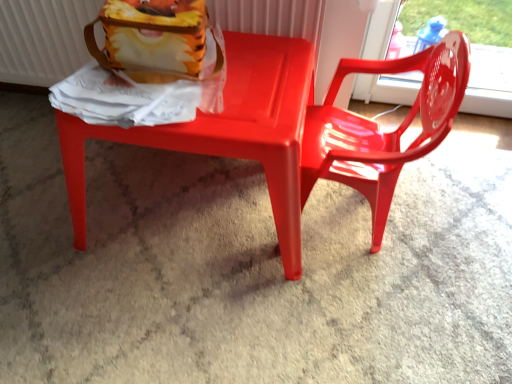
Question: Can you confirm if glossy plastic chair at center, which is the second chair in left-to-right order, is positioned to the left of matte white radiator at upper left?

Choices:
 (A) no
 (B) yes

Answer: (A)

Question: Considering the relative positions of glossy plastic chair at center, the first chair positioned from the right, and matte white radiator at upper left in the image provided, is glossy plastic chair at center, the first chair positioned from the right, behind matte white radiator at upper left?

Choices:
 (A) yes
 (B) no

Answer: (B)

Question: Is glossy plastic chair at center, the first chair positioned from the right, wider than matte white radiator at upper left?

Choices:
 (A) no
 (B) yes

Answer: (B)

Question: From a real-world perspective, is glossy plastic chair at center, the first chair positioned from the right, on top of matte white radiator at upper left?

Choices:
 (A) no
 (B) yes

Answer: (A)

Question: From the image's perspective, would you say glossy plastic chair at center, which is the second chair in left-to-right order, is shown under matte white radiator at upper left?

Choices:
 (A) yes
 (B) no

Answer: (A)

Question: Is glossy plastic chair at center, the first chair positioned from the right, far away from matte white radiator at upper left?

Choices:
 (A) yes
 (B) no

Answer: (B)

Question: Does matte white radiator at upper left have a greater width compared to matte plastic chair at center, which is counted as the 1th chair, starting from the left?

Choices:
 (A) no
 (B) yes

Answer: (A)

Question: From a real-world perspective, is matte white radiator at upper left beneath matte plastic chair at center, which is counted as the 1th chair, starting from the left?

Choices:
 (A) no
 (B) yes

Answer: (A)

Question: From a real-world perspective, is matte white radiator at upper left physically above matte plastic chair at center, the 2th chair positioned from the right?

Choices:
 (A) no
 (B) yes

Answer: (B)

Question: Could you tell me if matte white radiator at upper left is facing matte plastic chair at center, which is counted as the 1th chair, starting from the left?

Choices:
 (A) yes
 (B) no

Answer: (A)

Question: Is matte white radiator at upper left to the left of matte plastic chair at center, which is counted as the 1th chair, starting from the left, from the viewer's perspective?

Choices:
 (A) no
 (B) yes

Answer: (B)

Question: Does matte white radiator at upper left lie in front of matte plastic chair at center, which is counted as the 1th chair, starting from the left?

Choices:
 (A) yes
 (B) no

Answer: (B)

Question: Can we say matte plastic chair at center, the 2th chair positioned from the right, lies outside matte white radiator at upper left?

Choices:
 (A) no
 (B) yes

Answer: (B)